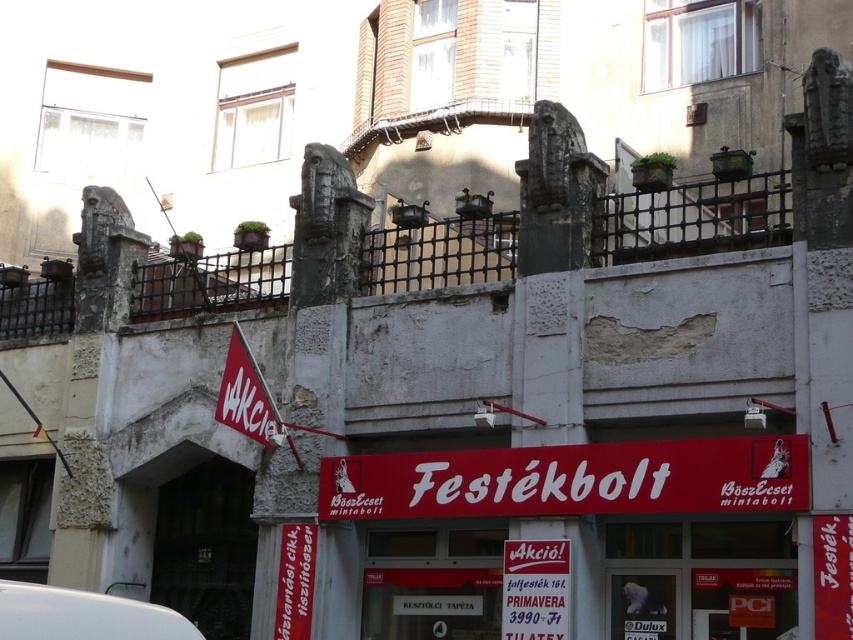
Find the location of `white matte van at lower left`. white matte van at lower left is located at coordinates (83, 616).

Does white matte van at lower left lie behind white paper banner at center?

No, it is not.

Is point (32, 620) positioned after point (287, 557)?

No, (32, 620) is in front of (287, 557).

This screenshot has width=853, height=640. I want to click on white matte van at lower left, so click(83, 616).

Who is more distant from viewer, (535, 467) or (144, 632)?

The point (535, 467) is behind.

Based on the photo, who is shorter, red matte sign at center or white matte van at lower left?

Standing shorter between the two is white matte van at lower left.

Between point (753, 451) and point (24, 618), which one is positioned behind?

Point (753, 451)

Where is `red matte sign at center`? This screenshot has width=853, height=640. red matte sign at center is located at coordinates (572, 480).

Find the location of `red matte sign at center`. red matte sign at center is located at coordinates (572, 480).

Is red matte sign at center behind red fabric sign at lower left?

No, it is in front of red fabric sign at lower left.

Find the location of a particular element. red matte sign at center is located at coordinates (572, 480).